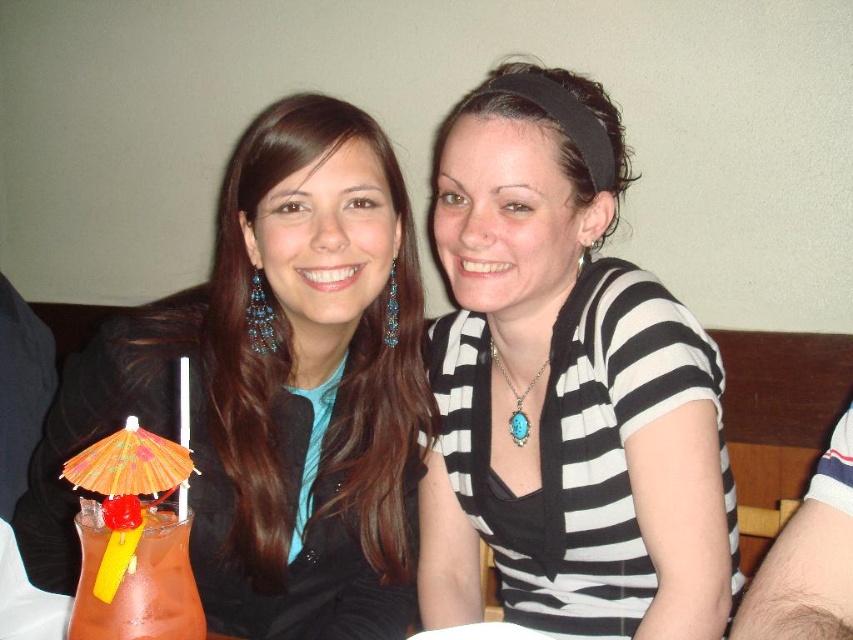
You are a photographer trying to capture a photo of the matte black jacket at left and the matte orange drink at lower left. Since you want to ensure both are in focus, you need to know their heights. Which one is taller?

The matte black jacket at left is taller than the matte orange drink at lower left.